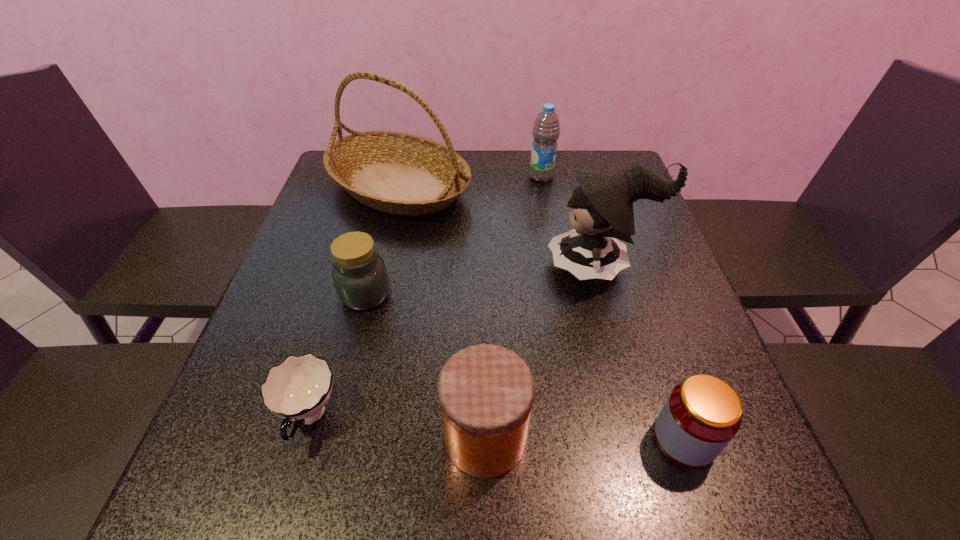
At what (x,y) coordinates should I click in order to perform the action: click on basket. Please return your answer as a coordinate pair (x, y). This screenshot has height=540, width=960. Looking at the image, I should click on (398, 173).

Locate an element on the screen. Image resolution: width=960 pixels, height=540 pixels. doll is located at coordinates (602, 205).

Where is `water bottle`? water bottle is located at coordinates (546, 130).

Image resolution: width=960 pixels, height=540 pixels. Find the location of `the fourth shortest object`. the fourth shortest object is located at coordinates (486, 391).

Where is `the second jar from left to right`? The width and height of the screenshot is (960, 540). the second jar from left to right is located at coordinates (486, 391).

Identify the location of the farthest jar. This screenshot has height=540, width=960. (360, 276).

At what (x,y) coordinates should I click in order to perform the action: click on the rightmost jar. Please return your answer as a coordinate pair (x, y). Looking at the image, I should click on (702, 414).

Where is `cup`? This screenshot has width=960, height=540. cup is located at coordinates (298, 389).

Identify the location of free space located on the right of the basket. (613, 186).

The height and width of the screenshot is (540, 960). In order to click on free region located 0.180m at the face of the doll in this screenshot , I will do 469,266.